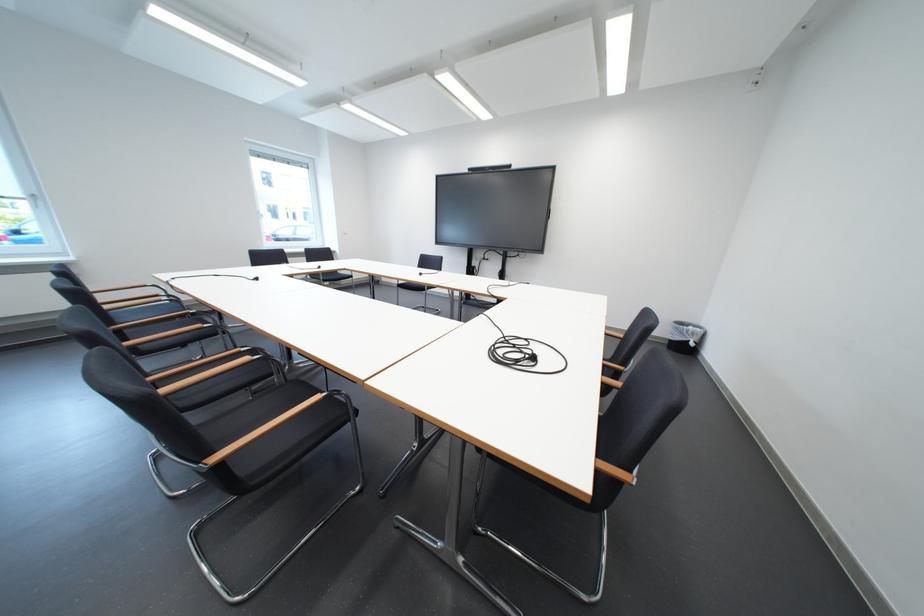
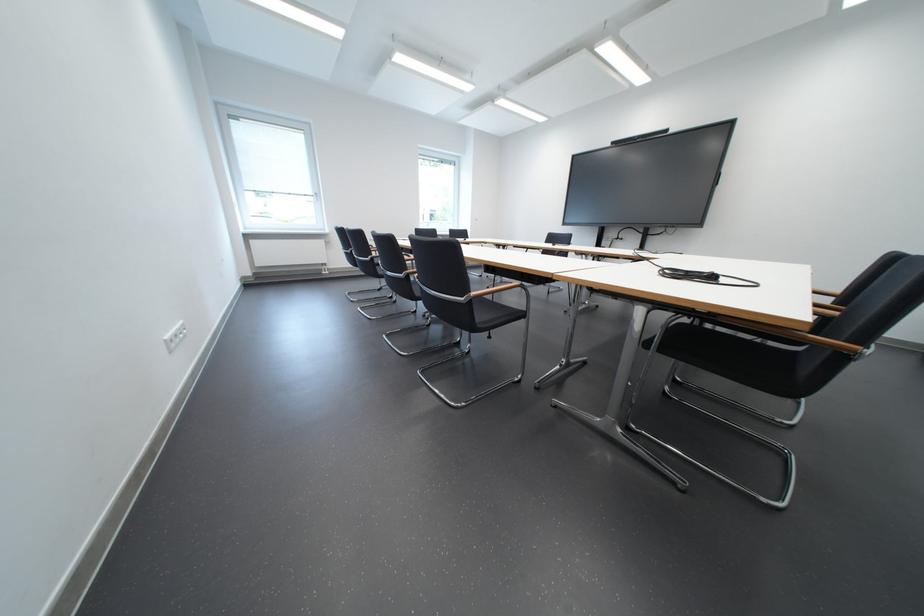
Question: The first image is from the beginning of the video and the second image is from the end. How did the camera likely rotate when shooting the video?

Choices:
 (A) Left
 (B) Right
 (C) Up
 (D) Down

Answer: (A)